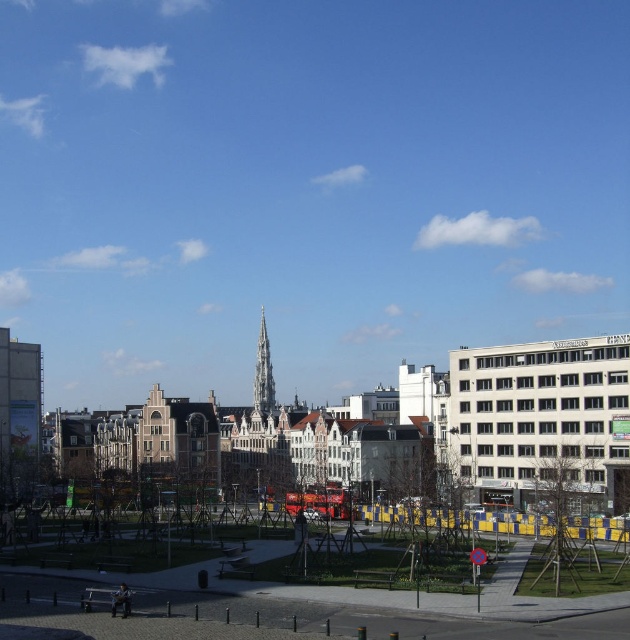
Can you confirm if green grass at center is bigger than blue glass spire at center?

No, green grass at center is not bigger than blue glass spire at center.

Which is below, green grass at center or blue glass spire at center?

green grass at center is below.

Between point (248, 621) and point (272, 380), which one is positioned in front?

Point (248, 621) is in front.

You are a GUI agent. You are given a task and a screenshot of the screen. Output one action in this format:
    pyautogui.click(x=<x>, y=<y>)
    Task: Click on the green grass at center
    
    Given the screenshot: What is the action you would take?
    pyautogui.click(x=295, y=608)